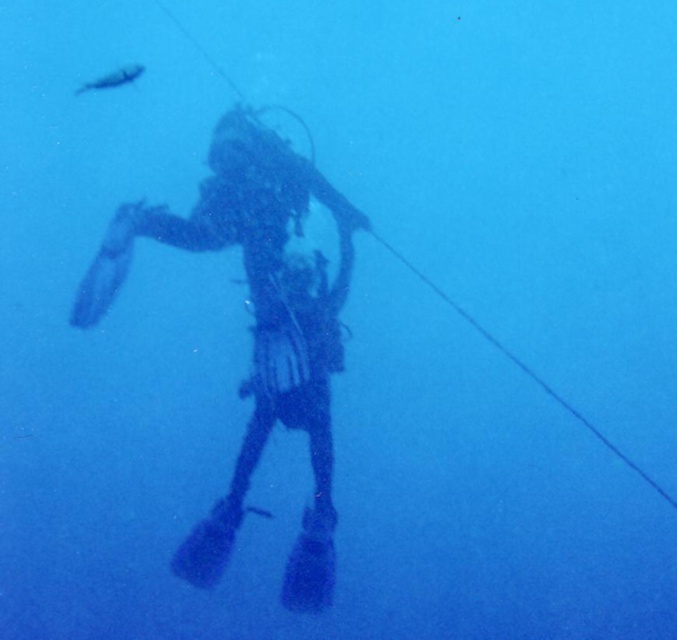
Which is more to the left, black matte scuba diver at center or translucent blue fin at center?

translucent blue fin at center

Can you confirm if black matte scuba diver at center is shorter than translucent blue fin at center?

Incorrect, black matte scuba diver at center's height does not fall short of translucent blue fin at center's.

Is point (93, 296) farther from viewer compared to point (104, 300)?

No, it is not.

Identify the location of black matte scuba diver at center. The image size is (677, 640). (253, 330).

Is point (102, 259) closer to viewer compared to point (131, 70)?

No, (102, 259) is behind (131, 70).

Who is more distant from viewer, (133, 244) or (123, 84)?

Positioned behind is point (133, 244).

Where is `translucent blue fin at center`? translucent blue fin at center is located at coordinates (108, 266).

Does black matte scuba diver at center appear under shiny silver fish at upper left?

Indeed, black matte scuba diver at center is positioned under shiny silver fish at upper left.

Locate an element on the screen. This screenshot has height=640, width=677. black matte scuba diver at center is located at coordinates (253, 330).